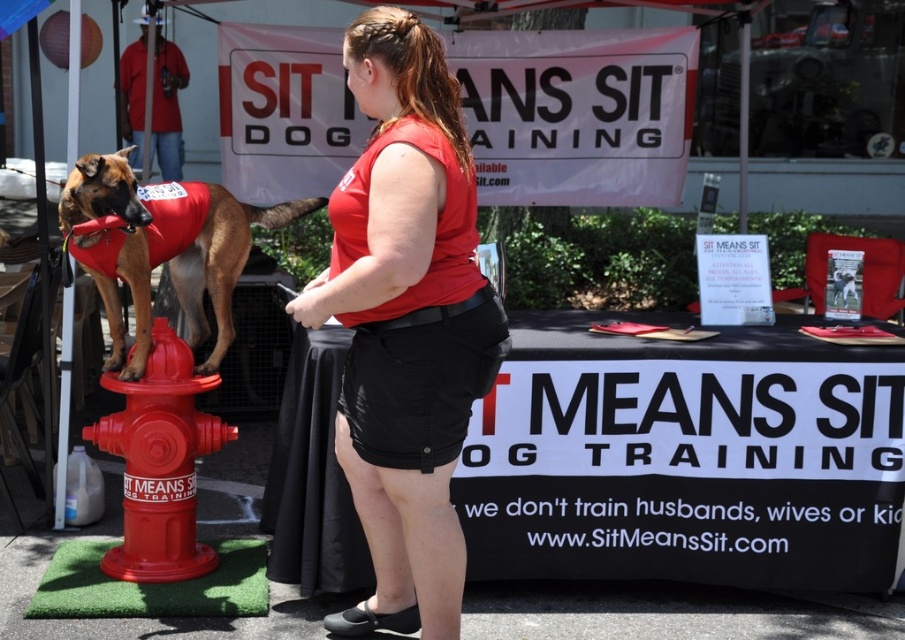
You are standing at the German Shepherd and want to walk towards the table with the banner. Which direction should you go first, towards point [426,128] or point [207,289]?

You should go towards point [426,128] first because it is closer to the viewer than point [207,289], so it is on the path towards the table.

You are a participant in the dog training event and need to place a new promotional item on the table. The item is 10 inches wide. Can the matte red vest at left fit on the table without overlapping the shiny plastic fire hydrant at lower left?

The matte red vest at left is larger in size than the shiny plastic fire hydrant at lower left. Since the vest is bigger, it might require more space, so placing the item might not be possible without overlapping.